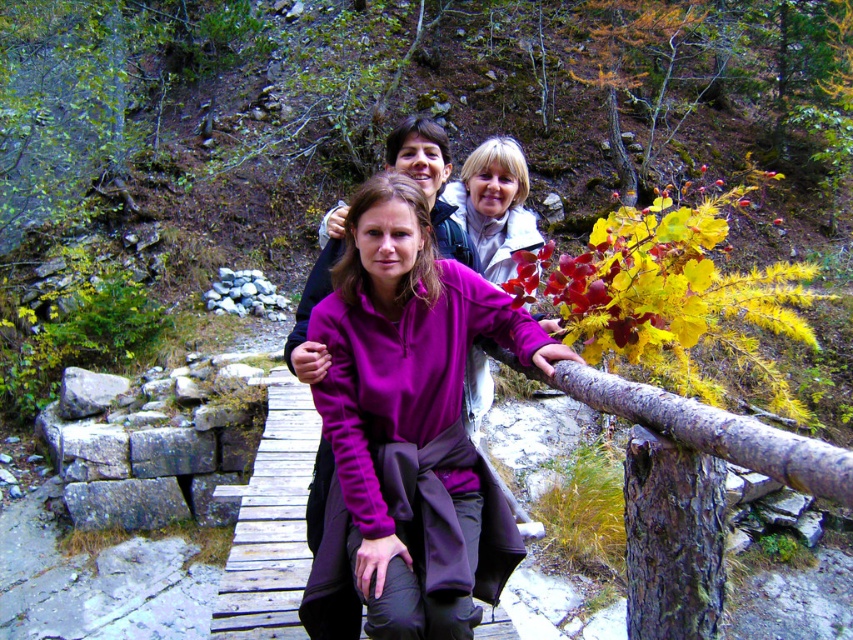
Question: In this image, where is purple fleece jacket at center located relative to wooden bridge at center?

Choices:
 (A) left
 (B) right

Answer: (B)

Question: Is the position of purple fleece jacket at center more distant than that of wooden bridge at center?

Choices:
 (A) no
 (B) yes

Answer: (A)

Question: Which object is closer to the camera taking this photo?

Choices:
 (A) purple fleece jacket at center
 (B) wooden bridge at center

Answer: (A)

Question: Observing the image, what is the correct spatial positioning of purple fleece jacket at center in reference to wooden bridge at center?

Choices:
 (A) left
 (B) right

Answer: (B)

Question: Which object is farther from the camera taking this photo?

Choices:
 (A) wooden bridge at center
 (B) purple fleece jacket at center

Answer: (A)

Question: Which of the following is the closest to the observer?

Choices:
 (A) (268, 556)
 (B) (515, 550)

Answer: (B)